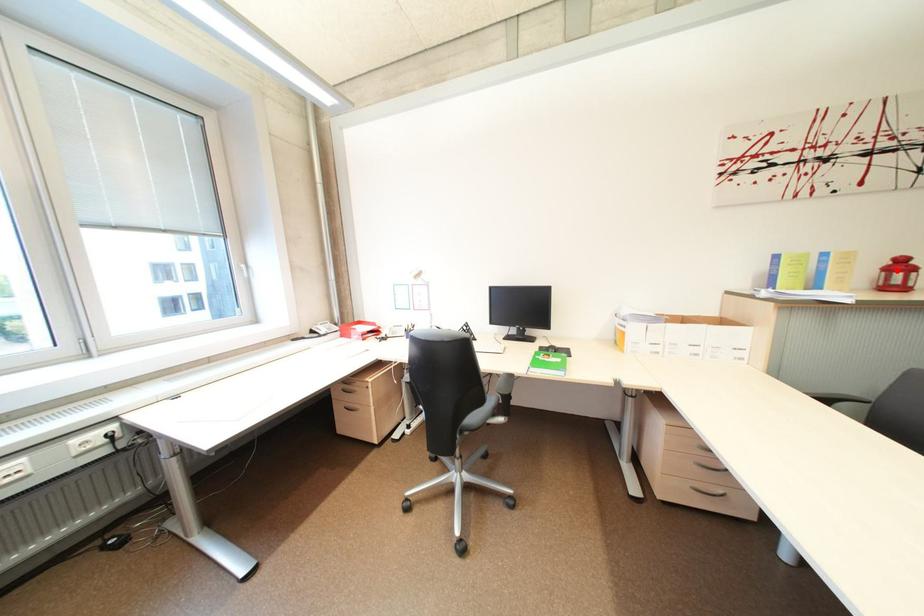
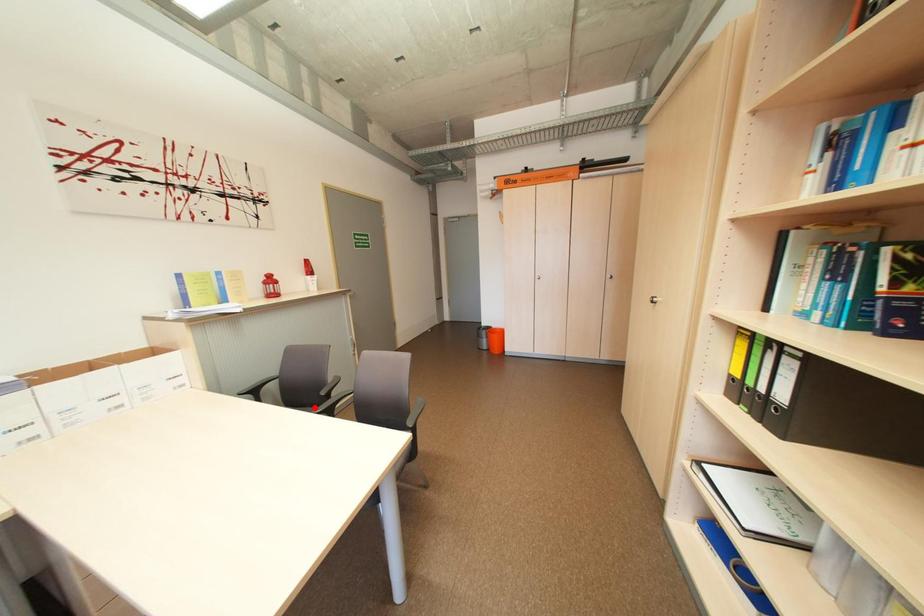
I am providing you with two images of the same scene from different viewpoints. A red point is marked on the first image and another point is marked on the second image. Does the point marked in image1 correspond to the same location as the one in image2?

No